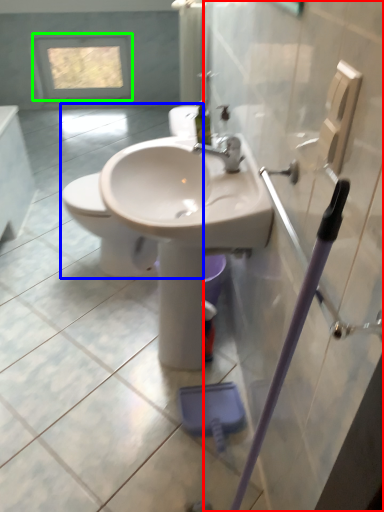
Question: Which object is the closest to the screen door (highlighted by a red box)? Choose among these: toilet (highlighted by a blue box) or window (highlighted by a green box).

Choices:
 (A) toilet
 (B) window

Answer: (A)